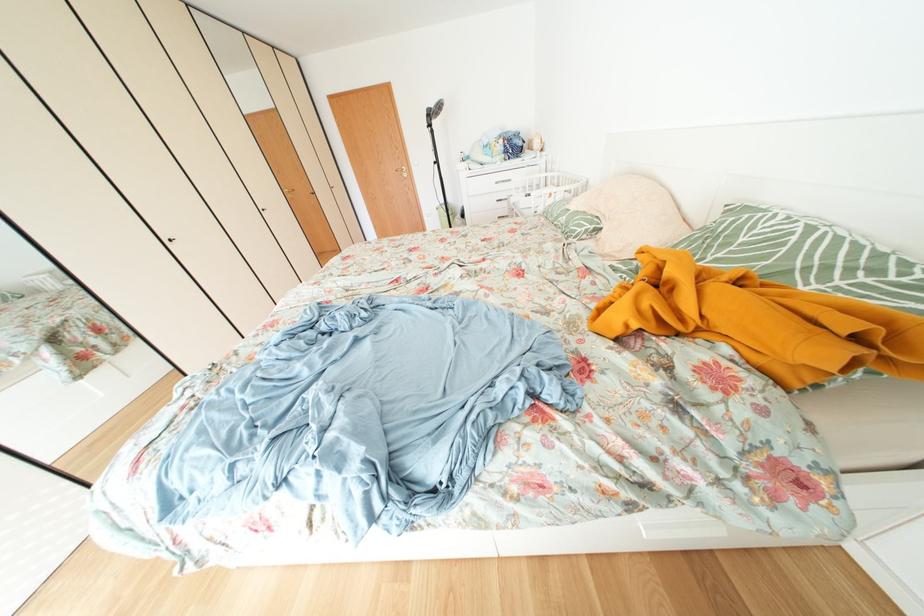
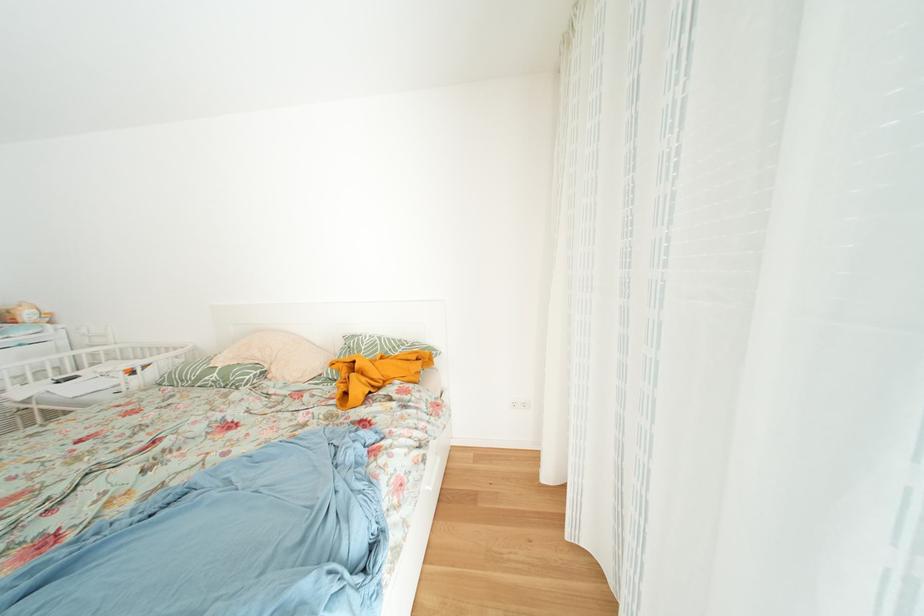
Where in the second image is the point corresponding to (565,223) from the first image?

(208, 384)